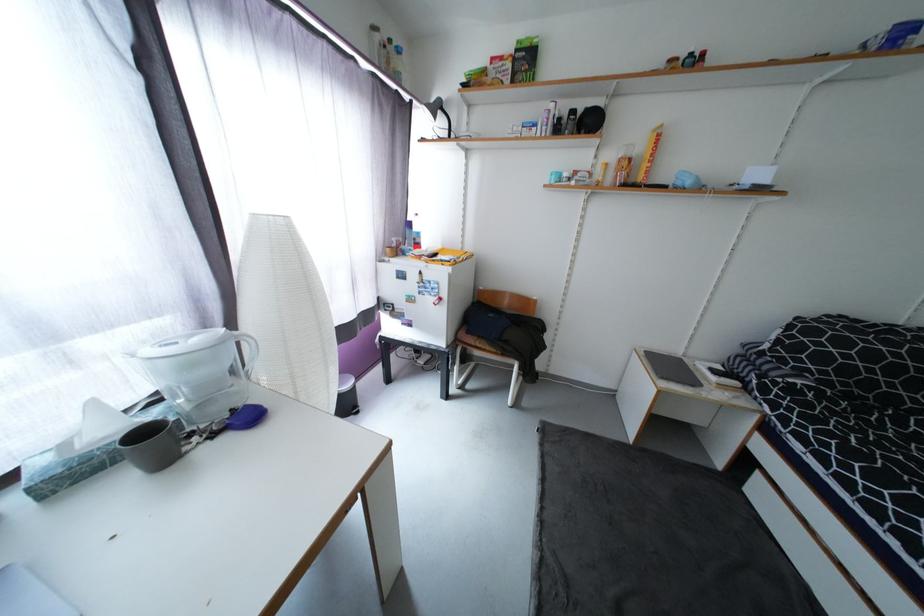
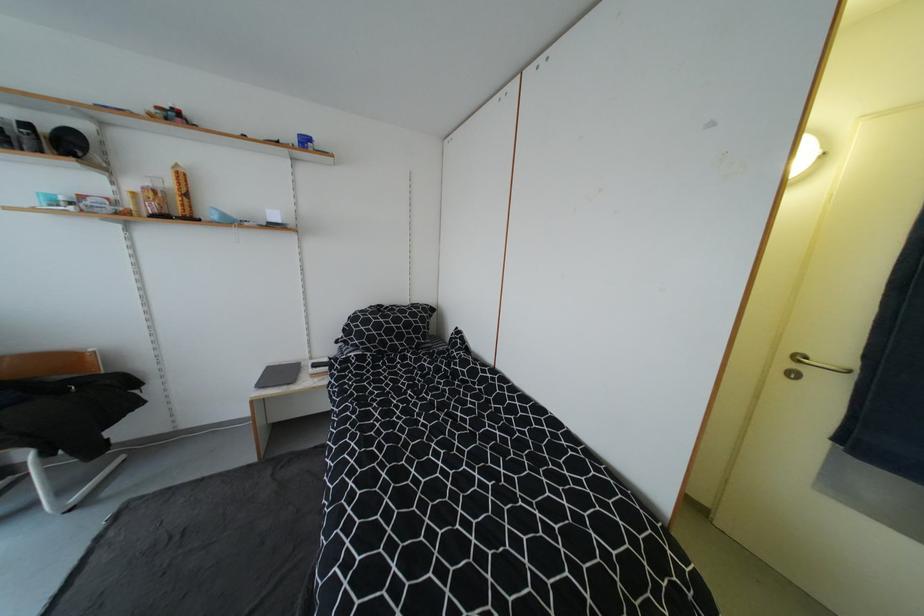
In the second image, find the point that corresponds to pixel 647 151 in the first image.

(176, 185)